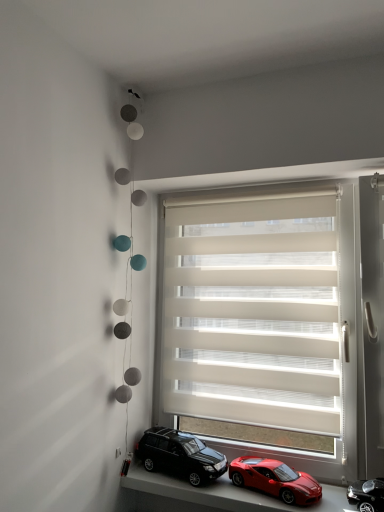
This screenshot has height=512, width=384. I want to click on smooth plastic toy cars at lower center, so click(225, 493).

In order to face beige fabric window blind at center, should I rotate leftwards or rightwards?

It's best to rotate right around 6.891 degrees.

In order to face shiny red car at lower center, the second car in the right-to-left sequence, should I rotate leftwards or rightwards?

Rotate right and turn 10.906 degrees.

Locate an element on the screen. This screenshot has width=384, height=512. smooth plastic toy cars at lower center is located at coordinates (225, 493).

Does point (357, 503) come in front of point (171, 467)?

Yes.

Is shiny black car at lower right, acting as the 1th car starting from the right, placed right next to shiny black suv at lower center, placed as the 3th car when sorted from right to left?

No, shiny black car at lower right, acting as the 1th car starting from the right, is not beside shiny black suv at lower center, placed as the 3th car when sorted from right to left.

From the image's perspective, is shiny black car at lower right, acting as the 3th car starting from the left, above or below shiny black suv at lower center, the first car in the left-to-right sequence?

shiny black car at lower right, acting as the 3th car starting from the left, is below shiny black suv at lower center, the first car in the left-to-right sequence.

In the scene shown: Measure the distance between shiny black car at lower right, acting as the 3th car starting from the left, and shiny black suv at lower center, the first car in the left-to-right sequence.

shiny black car at lower right, acting as the 3th car starting from the left, and shiny black suv at lower center, the first car in the left-to-right sequence, are 56.45 centimeters apart from each other.

Which object is more forward, shiny red car at lower center, the second car in the right-to-left sequence, or smooth plastic toy cars at lower center?

smooth plastic toy cars at lower center.

Is shiny red car at lower center, the second car in the right-to-left sequence, next to smooth plastic toy cars at lower center and touching it?

Yes, shiny red car at lower center, the second car in the right-to-left sequence, is with smooth plastic toy cars at lower center.

From a real-world perspective, is shiny red car at lower center, the second car in the right-to-left sequence, beneath smooth plastic toy cars at lower center?

Actually, shiny red car at lower center, the second car in the right-to-left sequence, is physically above smooth plastic toy cars at lower center in the real world.

Is smooth plastic toy cars at lower center to the left of beige fabric window blind at center from the viewer's perspective?

Indeed, smooth plastic toy cars at lower center is positioned on the left side of beige fabric window blind at center.

Based on the photo, from a real-world perspective, is smooth plastic toy cars at lower center positioned under beige fabric window blind at center based on gravity?

Correct, in the physical world, smooth plastic toy cars at lower center is lower than beige fabric window blind at center.

Which of these two, smooth plastic toy cars at lower center or beige fabric window blind at center, stands taller?

beige fabric window blind at center.

In terms of width, does smooth plastic toy cars at lower center look wider or thinner when compared to beige fabric window blind at center?

Considering their sizes, smooth plastic toy cars at lower center looks broader than beige fabric window blind at center.

Which object is closer to the camera, shiny red car at lower center, the second car in the right-to-left sequence, or beige fabric window blind at center?

shiny red car at lower center, the second car in the right-to-left sequence, is in front.

From a real-world perspective, between shiny red car at lower center, the 2th car in the left-to-right sequence, and beige fabric window blind at center, who is vertically lower?

From a 3D spatial view, shiny red car at lower center, the 2th car in the left-to-right sequence, is below.

Who is smaller, shiny red car at lower center, the second car in the right-to-left sequence, or beige fabric window blind at center?

With smaller size is shiny red car at lower center, the second car in the right-to-left sequence.

Does point (240, 480) come closer to viewer compared to point (300, 360)?

Yes, point (240, 480) is in front of point (300, 360).

Can you confirm if beige fabric window blind at center is thinner than shiny black car at lower right, acting as the 3th car starting from the left?

Indeed, beige fabric window blind at center has a lesser width compared to shiny black car at lower right, acting as the 3th car starting from the left.

Between point (215, 224) and point (378, 488), which one is positioned behind?

The point (215, 224) is farther from the camera.

Does beige fabric window blind at center appear on the left side of shiny black car at lower right, acting as the 1th car starting from the right?

Indeed, beige fabric window blind at center is positioned on the left side of shiny black car at lower right, acting as the 1th car starting from the right.

From a real-world perspective, is beige fabric window blind at center above or below shiny black car at lower right, acting as the 3th car starting from the left?

beige fabric window blind at center is above shiny black car at lower right, acting as the 3th car starting from the left.

The height and width of the screenshot is (512, 384). Find the location of `window sill in front of the beige fabric window blind at center`. window sill in front of the beige fabric window blind at center is located at coordinates (225, 493).

In the image, is beige fabric window blind at center positioned in front of or behind smooth plastic toy cars at lower center?

beige fabric window blind at center is behind smooth plastic toy cars at lower center.

Is smooth plastic toy cars at lower center at the back of beige fabric window blind at center?

No, smooth plastic toy cars at lower center is not at the back of beige fabric window blind at center.

Considering the relative positions of beige fabric window blind at center and smooth plastic toy cars at lower center in the image provided, is beige fabric window blind at center to the right of smooth plastic toy cars at lower center from the viewer's perspective?

Yes, beige fabric window blind at center is to the right of smooth plastic toy cars at lower center.

Can you confirm if smooth plastic toy cars at lower center is bigger than shiny black suv at lower center, the first car in the left-to-right sequence?

Indeed, smooth plastic toy cars at lower center has a larger size compared to shiny black suv at lower center, the first car in the left-to-right sequence.

Considering the sizes of objects smooth plastic toy cars at lower center and shiny black suv at lower center, the first car in the left-to-right sequence, in the image provided, who is shorter, smooth plastic toy cars at lower center or shiny black suv at lower center, the first car in the left-to-right sequence,?

smooth plastic toy cars at lower center is shorter.

Relative to shiny black suv at lower center, the first car in the left-to-right sequence, is smooth plastic toy cars at lower center in front or behind?

Visually, smooth plastic toy cars at lower center is located in front of shiny black suv at lower center, the first car in the left-to-right sequence.

You are a GUI agent. You are given a task and a screenshot of the screen. Output one action in this format:
    pyautogui.click(x=<x>, y=<y>)
    Task: Click on the 2nd car counting from the left side of the shiny black car at lower right, acting as the 3th car starting from the left
    
    Given the screenshot: What is the action you would take?
    pyautogui.click(x=179, y=455)

Identify the location of window sill below the shiny red car at lower center, the 2th car in the left-to-right sequence (from a real-world perspective). Image resolution: width=384 pixels, height=512 pixels. (225, 493).

Based on their spatial positions, is shiny black suv at lower center, placed as the 3th car when sorted from right to left, or beige fabric window blind at center further from shiny red car at lower center, the second car in the right-to-left sequence?

beige fabric window blind at center.

Looking at the image, which one is located further to shiny black car at lower right, acting as the 1th car starting from the right, shiny red car at lower center, the second car in the right-to-left sequence, or beige fabric window blind at center?

beige fabric window blind at center lies further to shiny black car at lower right, acting as the 1th car starting from the right, than the other object.

When comparing their distances from shiny red car at lower center, the second car in the right-to-left sequence, does shiny black car at lower right, acting as the 3th car starting from the left, or smooth plastic toy cars at lower center seem further?

shiny black car at lower right, acting as the 3th car starting from the left, is positioned further to the anchor shiny red car at lower center, the second car in the right-to-left sequence.

Considering their positions, is shiny black car at lower right, acting as the 1th car starting from the right, positioned closer to shiny red car at lower center, the second car in the right-to-left sequence, than beige fabric window blind at center?

shiny black car at lower right, acting as the 1th car starting from the right, lies closer to shiny red car at lower center, the second car in the right-to-left sequence, than the other object.

Which object lies nearer to the anchor point beige fabric window blind at center, shiny black suv at lower center, placed as the 3th car when sorted from right to left, or shiny red car at lower center, the 2th car in the left-to-right sequence?

Among the two, shiny black suv at lower center, placed as the 3th car when sorted from right to left, is located nearer to beige fabric window blind at center.

When comparing their distances from smooth plastic toy cars at lower center, does beige fabric window blind at center or shiny black suv at lower center, placed as the 3th car when sorted from right to left, seem further?

Based on the image, beige fabric window blind at center appears to be further to smooth plastic toy cars at lower center.

Estimate the real-world distances between objects in this image. Which object is closer to shiny red car at lower center, the second car in the right-to-left sequence, shiny black car at lower right, acting as the 3th car starting from the left, or shiny black suv at lower center, placed as the 3th car when sorted from right to left?

shiny black suv at lower center, placed as the 3th car when sorted from right to left, is positioned closer to the anchor shiny red car at lower center, the second car in the right-to-left sequence.

Which object lies further to the anchor point smooth plastic toy cars at lower center, shiny black suv at lower center, placed as the 3th car when sorted from right to left, or beige fabric window blind at center?

The object further to smooth plastic toy cars at lower center is beige fabric window blind at center.

Image resolution: width=384 pixels, height=512 pixels. Find the location of `window sill between shiny black suv at lower center, the first car in the left-to-right sequence, and shiny black car at lower right, acting as the 1th car starting from the right, in the horizontal direction`. window sill between shiny black suv at lower center, the first car in the left-to-right sequence, and shiny black car at lower right, acting as the 1th car starting from the right, in the horizontal direction is located at coordinates (225, 493).

Find the location of a particular element. This screenshot has height=512, width=384. car between shiny black suv at lower center, the first car in the left-to-right sequence, and shiny black car at lower right, acting as the 3th car starting from the left, from left to right is located at coordinates (275, 479).

This screenshot has width=384, height=512. Identify the location of car between smooth plastic toy cars at lower center and shiny black car at lower right, acting as the 3th car starting from the left, from left to right. (275, 479).

At what (x,y) coordinates should I click in order to perform the action: click on window blind located between shiny black suv at lower center, placed as the 3th car when sorted from right to left, and shiny black car at lower right, acting as the 3th car starting from the left, in the left-right direction. Please return your answer as a coordinate pair (x, y). The height and width of the screenshot is (512, 384). Looking at the image, I should click on (253, 317).